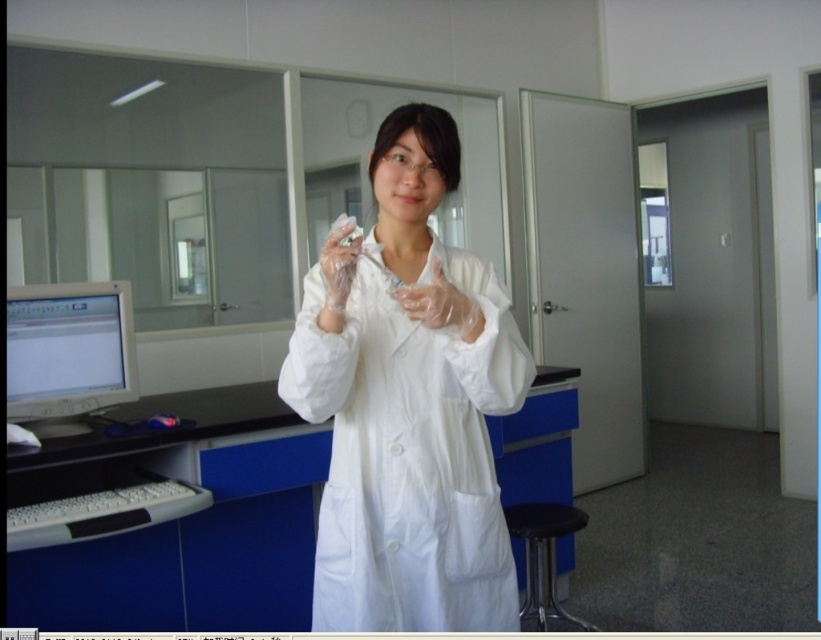
You are a visitor in the lab and need to sit down. You see the white lab coat at center and the black plastic stool at lower right. Which object is taller, and can you sit on the stool?

The white lab coat at center is taller than the black plastic stool at lower right. However, the stool is meant for sitting, so you can sit on the black plastic stool at lower right.

In the scene shown: You are a researcher who needs to place a 15 cm wide tool on the desk. The tool must fit entirely within the space between the matte gray monitor at left and the clear plastic glove at center. Can you do it?

The matte gray monitor at left is wider than the clear plastic glove at center. However, since the exact distance between them isn not provided, we cannot confirm if the 15 cm tool will fit. More information is needed.

Looking at this image, you are a researcher who needs to adjust the settings on the matte gray monitor at left. However, you notice your clear plastic glove at center might interfere with the touch screen. Is the monitor below or above the glove?

The matte gray monitor at left is located below the clear plastic glove at center, so it is positioned lower than the glove. This means the glove might not interfere with the touch screen since the monitor is below it.